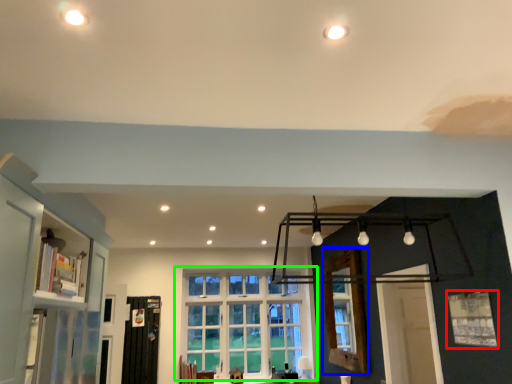
Question: Estimate the real-world distances between objects in this image. Which object is closer to window (highlighted by a red box), window frame (highlighted by a blue box) or window (highlighted by a green box)?

Choices:
 (A) window frame
 (B) window

Answer: (A)